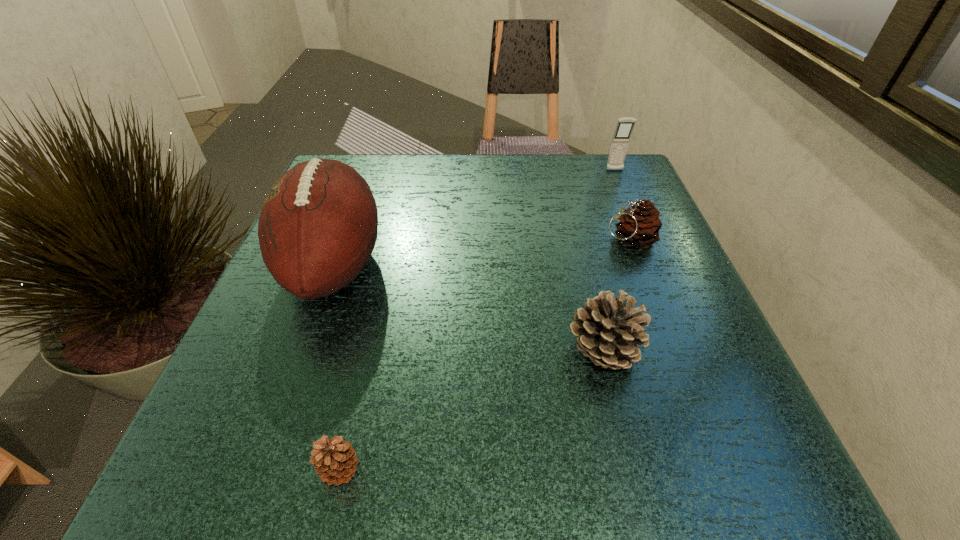
Where is `vacant region at the far edge`? This screenshot has height=540, width=960. vacant region at the far edge is located at coordinates (453, 161).

In the image, there is a desktop. Where is `free space at the near edge`? free space at the near edge is located at coordinates (404, 439).

You are a GUI agent. You are given a task and a screenshot of the screen. Output one action in this format:
    pyautogui.click(x=<x>, y=<y>)
    Task: Click on the free spot at the left edge of the desktop
    Image resolution: width=960 pixels, height=540 pixels.
    Given the screenshot: What is the action you would take?
    pyautogui.click(x=271, y=404)

Where is `vacant space at the right edge of the desktop`? vacant space at the right edge of the desktop is located at coordinates (703, 369).

The height and width of the screenshot is (540, 960). In the image, there is a desktop. In order to click on vacant space at the far left corner in this screenshot , I will do `click(352, 153)`.

The width and height of the screenshot is (960, 540). I want to click on vacant space at the far right corner of the desktop, so click(x=628, y=171).

You are a GUI agent. You are given a task and a screenshot of the screen. Output one action in this format:
    pyautogui.click(x=<x>, y=<y>)
    Task: Click on the vacant area between the nearest pinecone and the fourth tallest object
    
    Given the screenshot: What is the action you would take?
    pyautogui.click(x=485, y=355)

The image size is (960, 540). Identify the location of free space between the second shortest pinecone and the nearest object. (485, 355).

The height and width of the screenshot is (540, 960). I want to click on blank region between the second tallest pinecone and the football (American), so click(482, 252).

Where is `vacant region between the farthest object and the football (American)`? Image resolution: width=960 pixels, height=540 pixels. vacant region between the farthest object and the football (American) is located at coordinates (474, 218).